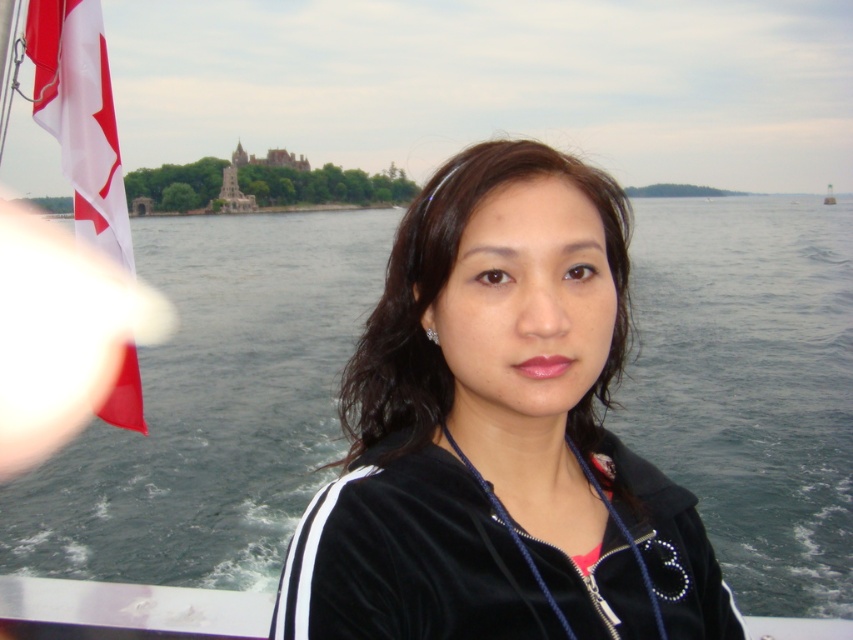
Does black velvety jacket at center appear on the left side of red fabric flag at left?

In fact, black velvety jacket at center is to the right of red fabric flag at left.

Is point (296, 534) less distant than point (35, 83)?

Yes.

The height and width of the screenshot is (640, 853). I want to click on black velvety jacket at center, so click(498, 433).